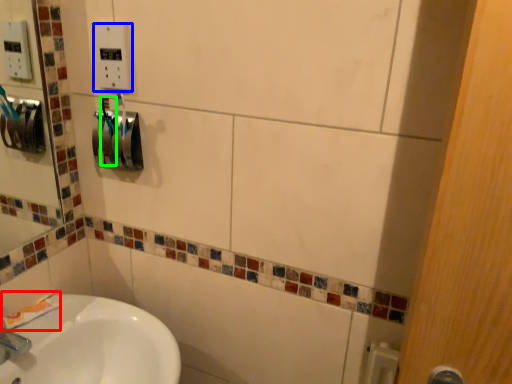
Question: Considering the real-world distances, which object is farthest from toothpaste (highlighted by a red box)? electric outlet (highlighted by a blue box) or toothbrush (highlighted by a green box)?

Choices:
 (A) electric outlet
 (B) toothbrush

Answer: (A)